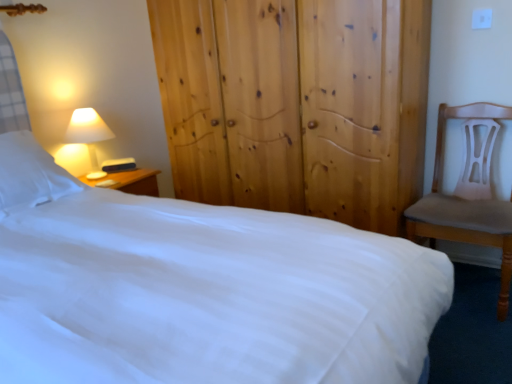
Question: Is white smooth bed at center smaller than matte white lampshade at left?

Choices:
 (A) no
 (B) yes

Answer: (A)

Question: Would you consider white smooth bed at center to be distant from matte white lampshade at left?

Choices:
 (A) no
 (B) yes

Answer: (B)

Question: Is white smooth bed at center at the right side of matte white lampshade at left?

Choices:
 (A) yes
 (B) no

Answer: (A)

Question: Is white smooth bed at center in front of matte white lampshade at left?

Choices:
 (A) yes
 (B) no

Answer: (A)

Question: Is white smooth bed at center located outside matte white lampshade at left?

Choices:
 (A) yes
 (B) no

Answer: (A)

Question: Is point 10,208 positioned closer to the camera than point 506,225?

Choices:
 (A) farther
 (B) closer

Answer: (B)

Question: Based on their positions, is white smooth bed at center located to the left or right of light brown wooden chair at right?

Choices:
 (A) right
 (B) left

Answer: (B)

Question: Considering the positions of white smooth bed at center and light brown wooden chair at right in the image, is white smooth bed at center wider or thinner than light brown wooden chair at right?

Choices:
 (A) wide
 (B) thin

Answer: (A)

Question: From a real-world perspective, is white smooth bed at center positioned above or below light brown wooden chair at right?

Choices:
 (A) below
 (B) above

Answer: (B)

Question: Considering their positions, is light brown wooden chair at right located in front of or behind white soft pillow at left?

Choices:
 (A) front
 (B) behind

Answer: (A)

Question: From the image's perspective, relative to white soft pillow at left, is light brown wooden chair at right above or below?

Choices:
 (A) below
 (B) above

Answer: (A)

Question: Considering the positions of light brown wooden chair at right and white soft pillow at left in the image, is light brown wooden chair at right bigger or smaller than white soft pillow at left?

Choices:
 (A) small
 (B) big

Answer: (B)

Question: Is light brown wooden chair at right inside the boundaries of white soft pillow at left, or outside?

Choices:
 (A) outside
 (B) inside

Answer: (A)

Question: Would you say matte white lampshade at left is inside or outside light brown wooden chair at right?

Choices:
 (A) inside
 (B) outside

Answer: (B)

Question: Is matte white lampshade at left taller or shorter than light brown wooden chair at right?

Choices:
 (A) tall
 (B) short

Answer: (B)